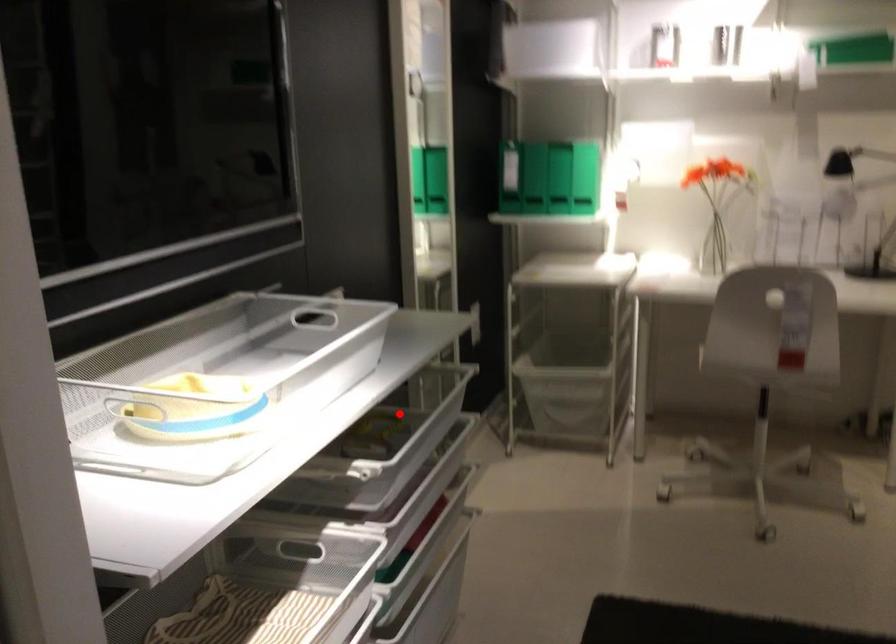
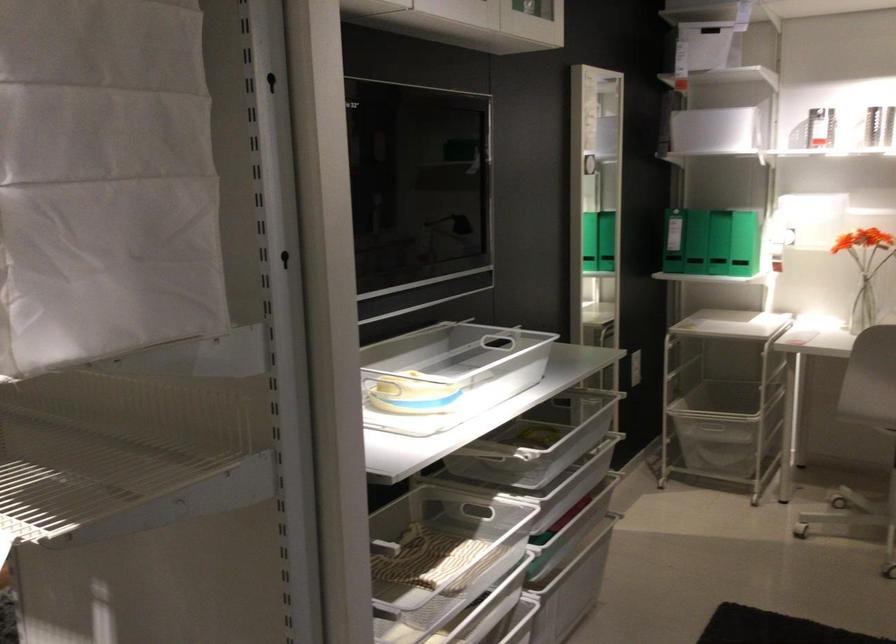
In the second image, find the point that corresponds to the highlighted location in the first image.

(561, 428)